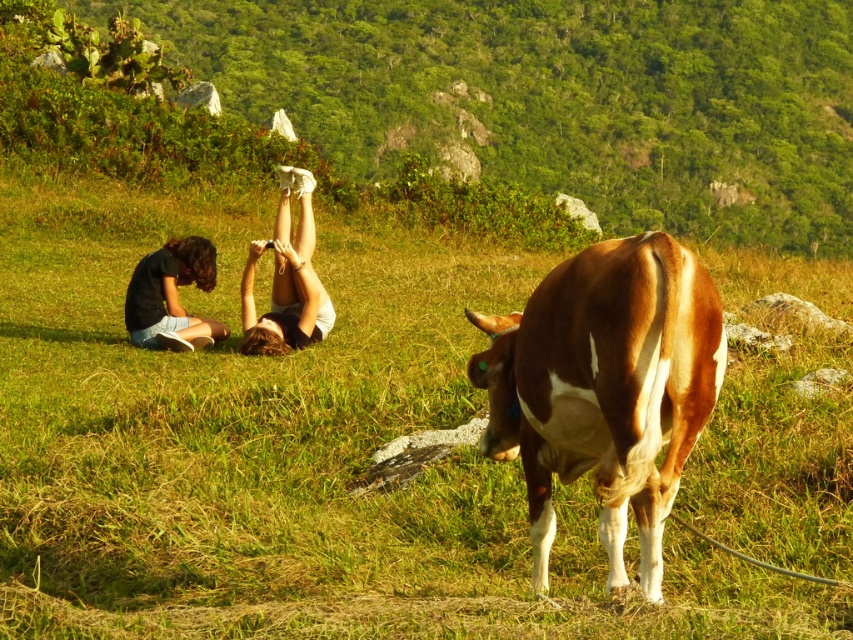
Question: Can you confirm if smooth white sneakers at center is thinner than matte black shirt at lower left?

Choices:
 (A) no
 (B) yes

Answer: (B)

Question: Estimate the real-world distances between objects in this image. Which object is farther from the smooth white sneakers at center?

Choices:
 (A) green grassy field at center
 (B) brown and white cow at center
 (C) matte black shorts at lower left
 (D) green leafy hillside at upper center

Answer: (D)

Question: Is green leafy hillside at upper center to the left of matte black shirt at lower left from the viewer's perspective?

Choices:
 (A) no
 (B) yes

Answer: (A)

Question: Does green grassy field at center come behind green leafy hillside at upper center?

Choices:
 (A) yes
 (B) no

Answer: (B)

Question: Which object is farther from the camera taking this photo?

Choices:
 (A) green grassy field at center
 (B) matte black shirt at lower left

Answer: (B)

Question: Estimate the real-world distances between objects in this image. Which object is closer to the smooth white sneakers at center?

Choices:
 (A) matte black shirt at lower left
 (B) brown and white cow at center
 (C) green leafy hillside at upper center

Answer: (A)